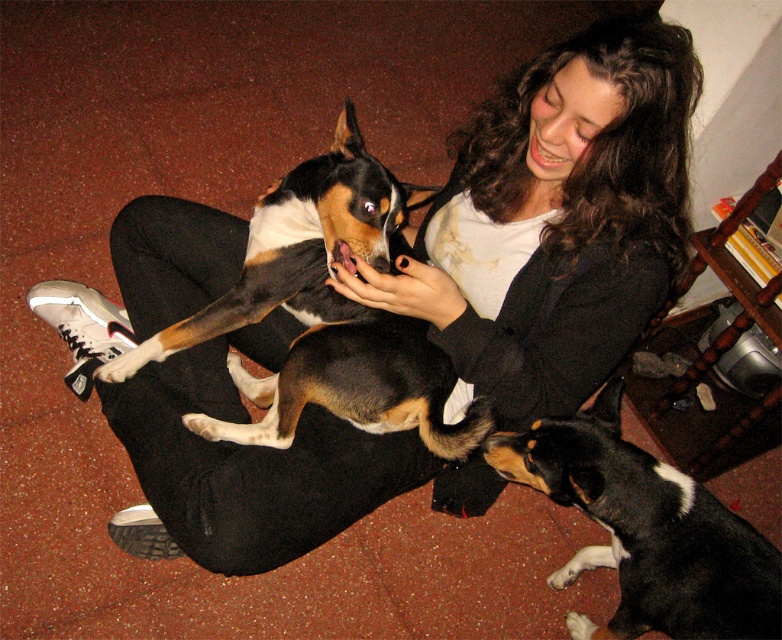
Who is positioned more to the left, brown and white fur at center or black and tan fur at center?

brown and white fur at center is more to the left.

Locate an element on the screen. This screenshot has width=782, height=640. brown and white fur at center is located at coordinates (325, 314).

At what (x,y) coordinates should I click in order to perform the action: click on brown and white fur at center. Please return your answer as a coordinate pair (x, y). Looking at the image, I should click on (325, 314).

The height and width of the screenshot is (640, 782). What are the coordinates of `brown and white fur at center` in the screenshot? It's located at (325, 314).